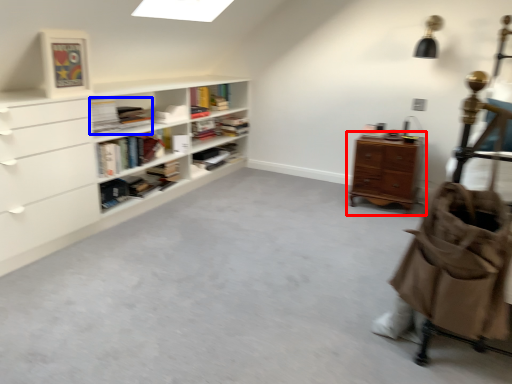
Question: Among these objects, which one is nearest to the camera, chest of drawers (highlighted by a red box) or book (highlighted by a blue box)?

Choices:
 (A) chest of drawers
 (B) book

Answer: (B)